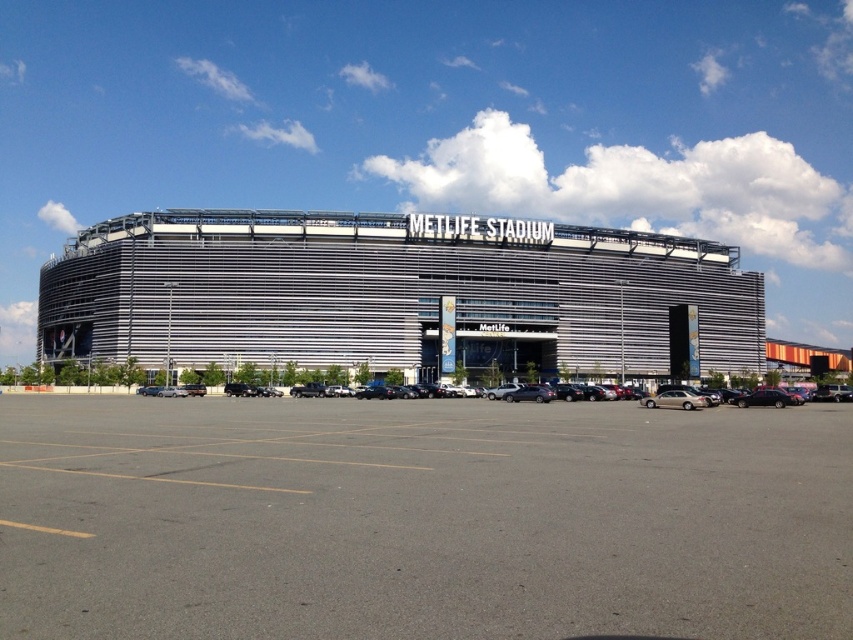
Looking at this image, you are a photographer planning to take a photo of the MetLife Stadium. You want to ensure that both the gray asphalt parking lot at center and the gold metallic sedan at center are clearly visible in the frame. Based on their relative sizes, which object will appear larger in the photo?

The gray asphalt parking lot at center appears larger in the photo because it is taller than the gold metallic sedan at center.

You are standing in front of MetLife Stadium and want to take a photo that includes both the point at coordinates [418,337] and the point at [691,397]. Which point should you focus on first to ensure both are in the frame?

You should focus on the point at [418,337] first because it is closer to you than the point at [691,397], ensuring both points remain in the frame.